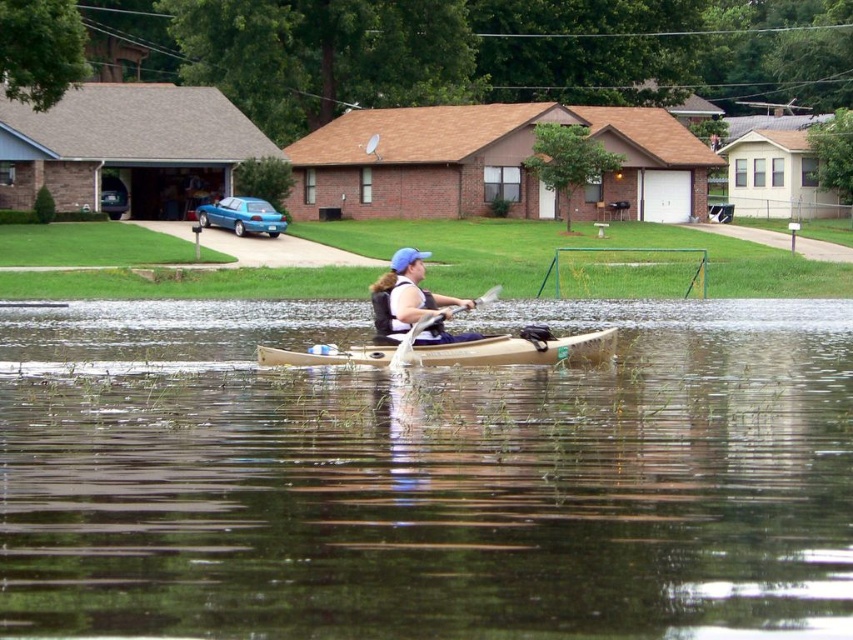
Question: Which of the following is the closest to the observer?

Choices:
 (A) (364, 616)
 (B) (486, 291)
 (C) (444, 348)

Answer: (A)

Question: Does tan matte canoe at center lie behind wooden paddle at center?

Choices:
 (A) yes
 (B) no

Answer: (A)

Question: Which object is the farthest from the tan matte canoe at center?

Choices:
 (A) wooden paddle at center
 (B) matte blue life vest at center

Answer: (A)

Question: From the image, what is the correct spatial relationship of tan matte canoe at center in relation to matte blue life vest at center?

Choices:
 (A) below
 (B) above

Answer: (A)

Question: Among these objects, which one is nearest to the camera?

Choices:
 (A) wooden paddle at center
 (B) matte blue life vest at center
 (C) brown matte water at center
 (D) tan matte canoe at center

Answer: (C)

Question: Does matte blue life vest at center appear under wooden paddle at center?

Choices:
 (A) yes
 (B) no

Answer: (B)